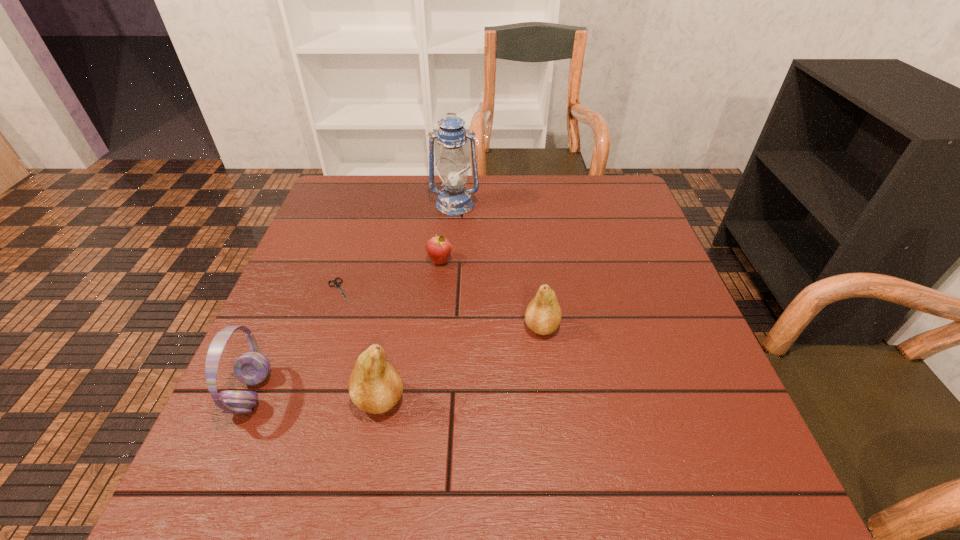
The image size is (960, 540). I want to click on free space for a new pear on the right, so click(x=664, y=271).